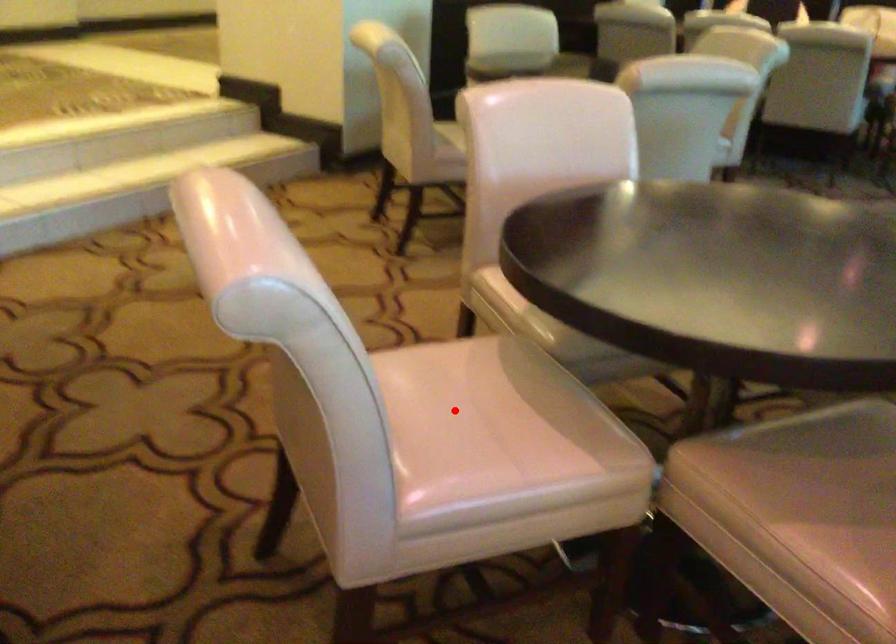
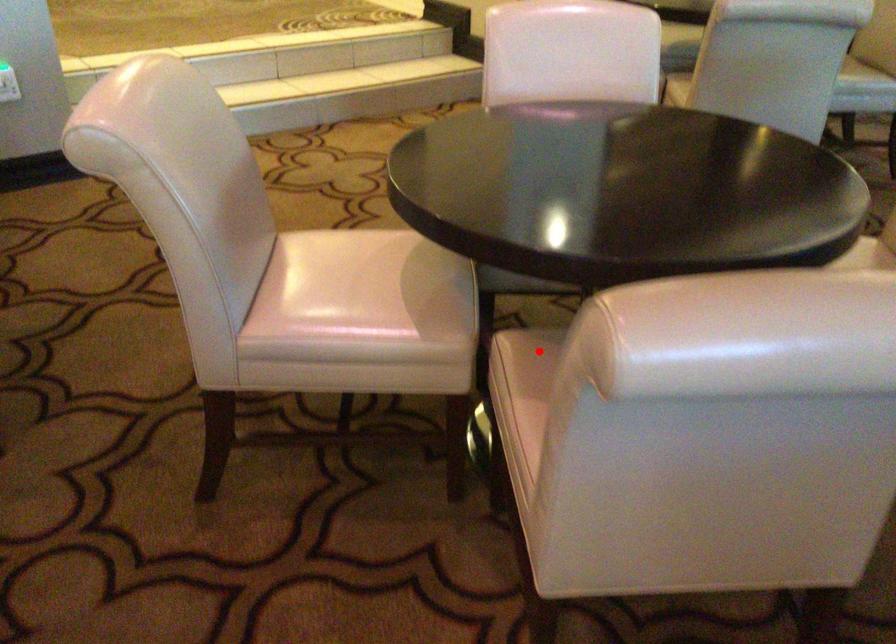
I am providing you with two images of the same scene from different viewpoints. A red point is marked on the first image and another point is marked on the second image. Are the points marked in image1 and image2 representing the same 3D position?

No